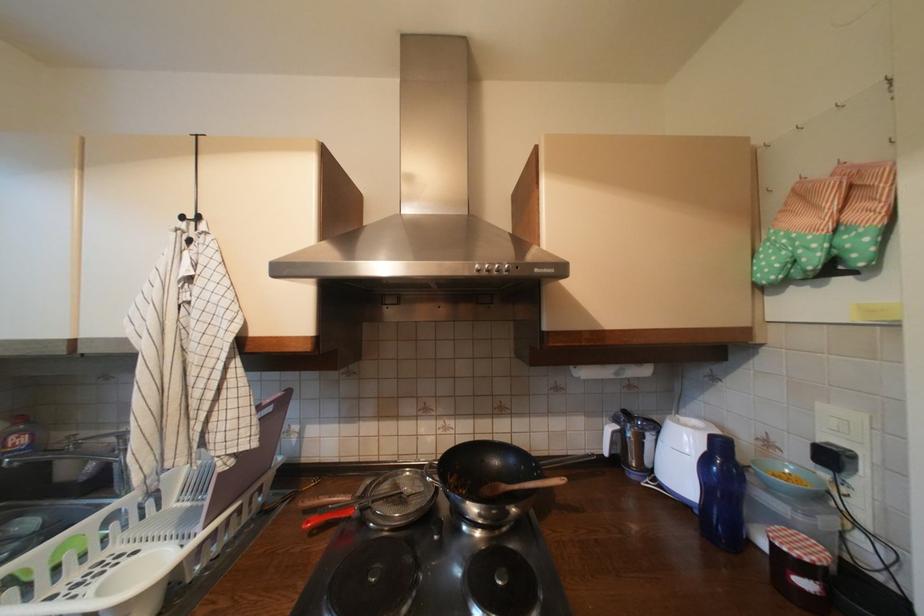
The height and width of the screenshot is (616, 924). Describe the element at coordinates (383, 500) in the screenshot. I see `the kettle handle` at that location.